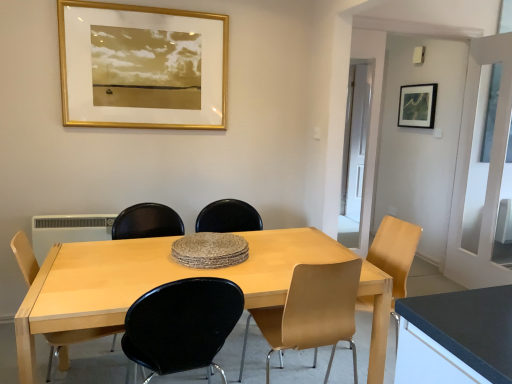
Question: Does light brown wood chair at lower left, the fourth chair in the right-to-left sequence, come in front of light brown wood chair at center, the 2th chair when ordered from right to left?

Choices:
 (A) no
 (B) yes

Answer: (A)

Question: Is light brown wood chair at lower left, the fourth chair in the right-to-left sequence, positioned with its back to light brown wood chair at center, marked as the third chair in a left-to-right arrangement?

Choices:
 (A) no
 (B) yes

Answer: (A)

Question: Does light brown wood chair at lower left, the fourth chair in the right-to-left sequence, have a greater height compared to light brown wood chair at center, marked as the third chair in a left-to-right arrangement?

Choices:
 (A) no
 (B) yes

Answer: (A)

Question: Is light brown wood chair at lower left, which appears as the 1th chair when viewed from the left, further to camera compared to light brown wood chair at center, the 2th chair when ordered from right to left?

Choices:
 (A) no
 (B) yes

Answer: (B)

Question: Is light brown wood chair at lower left, the fourth chair in the right-to-left sequence, wider than light brown wood chair at center, marked as the third chair in a left-to-right arrangement?

Choices:
 (A) yes
 (B) no

Answer: (B)

Question: From their relative heights in the image, would you say matte black picture frame at upper right, arranged as the 2th picture frame when viewed from the front, is taller or shorter than white plastic radiator at lower left?

Choices:
 (A) tall
 (B) short

Answer: (A)

Question: Is matte black picture frame at upper right, which is counted as the 1th picture frame, starting from the right, inside the boundaries of white plastic radiator at lower left, or outside?

Choices:
 (A) inside
 (B) outside

Answer: (B)

Question: In the image, is matte black picture frame at upper right, which is counted as the first picture frame, starting from the back, on the left side or the right side of white plastic radiator at lower left?

Choices:
 (A) left
 (B) right

Answer: (B)

Question: Does point (400, 89) appear closer or farther from the camera than point (90, 220)?

Choices:
 (A) farther
 (B) closer

Answer: (A)

Question: In terms of width, does white glossy door at center look wider or thinner when compared to matte black picture frame at upper right, arranged as the 2th picture frame when viewed from the front?

Choices:
 (A) thin
 (B) wide

Answer: (B)

Question: Is point (440, 238) positioned closer to the camera than point (419, 86)?

Choices:
 (A) closer
 (B) farther

Answer: (A)

Question: From the image's perspective, is white glossy door at center above or below matte black picture frame at upper right, the second picture frame when ordered from left to right?

Choices:
 (A) above
 (B) below

Answer: (B)

Question: From a real-world perspective, relative to matte black picture frame at upper right, which is counted as the first picture frame, starting from the back, is white glossy door at center vertically above or below?

Choices:
 (A) below
 (B) above

Answer: (A)

Question: Is point (27, 372) closer or farther from the camera than point (153, 21)?

Choices:
 (A) closer
 (B) farther

Answer: (A)

Question: Is light wood table at center bigger or smaller than gold/gilded picture frame at upper center, the second picture frame when ordered from right to left?

Choices:
 (A) small
 (B) big

Answer: (B)